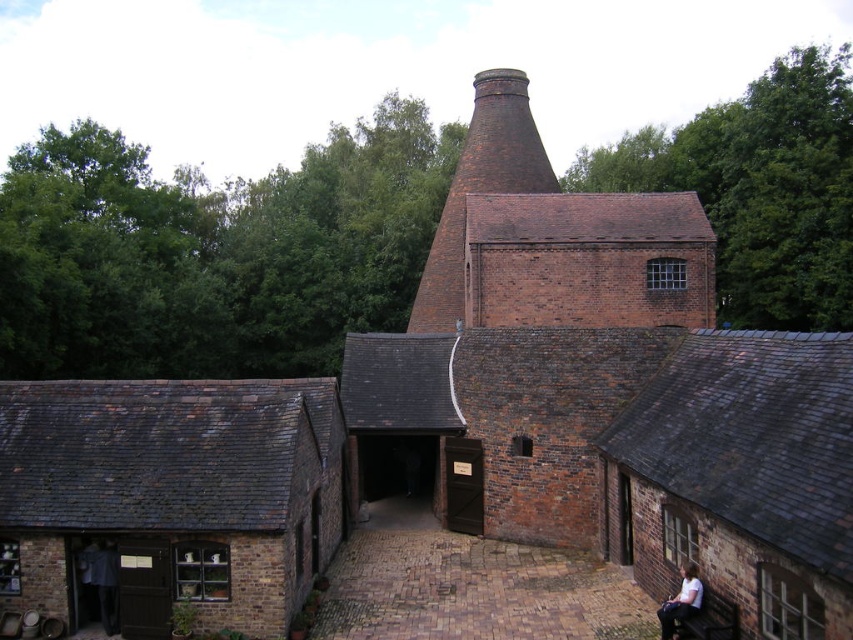
Does brown brick chimney at center appear on the left side of white cotton shirt at lower right?

Yes, brown brick chimney at center is to the left of white cotton shirt at lower right.

Based on the photo, who is lower down, brown brick chimney at center or white cotton shirt at lower right?

white cotton shirt at lower right is lower down.

In order to click on brown brick chimney at center in this screenshot , I will do `click(480, 188)`.